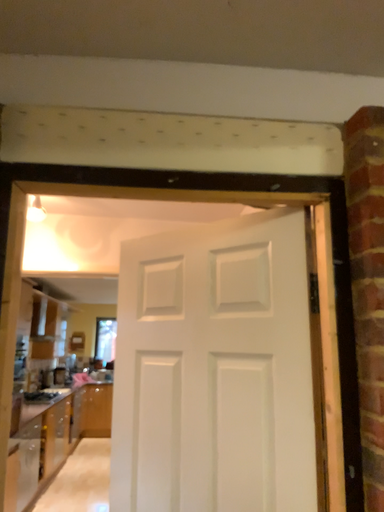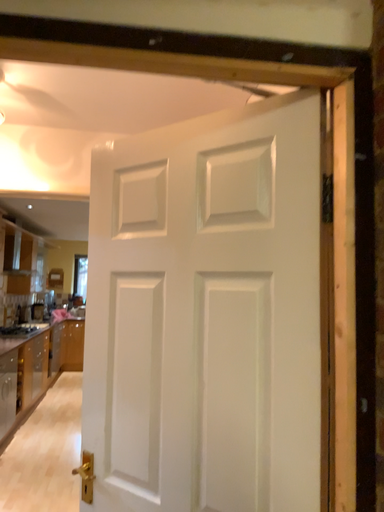
Question: How did the camera likely rotate when shooting the video?

Choices:
 (A) rotated downward
 (B) rotated upward

Answer: (A)